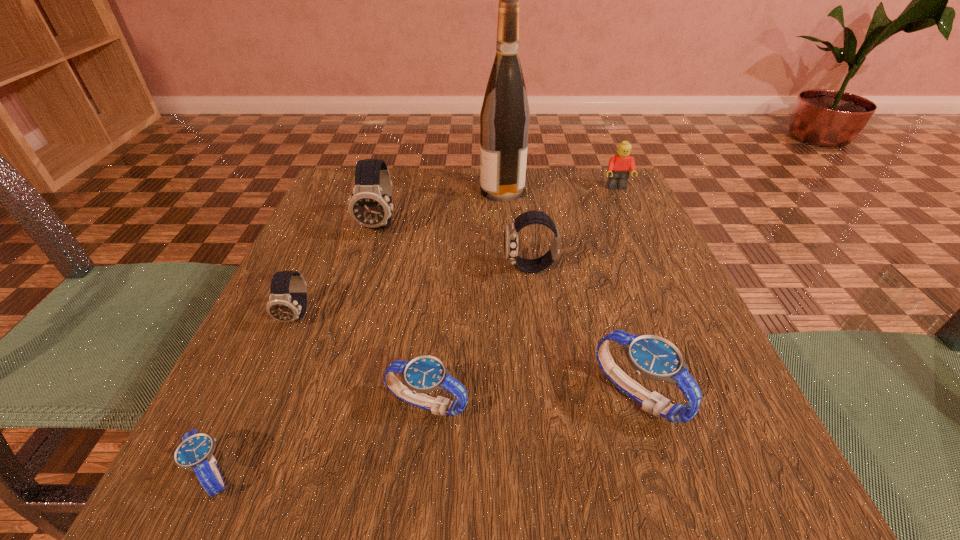
This screenshot has height=540, width=960. In order to click on object positioned at the far left corner in this screenshot , I will do `click(370, 205)`.

Locate an element on the screen. object situated at the near left corner is located at coordinates (195, 451).

Where is `object that is at the far right corner`? The image size is (960, 540). object that is at the far right corner is located at coordinates (620, 165).

The height and width of the screenshot is (540, 960). I want to click on free space at the far edge of the desktop, so click(409, 168).

Locate an element on the screen. The width and height of the screenshot is (960, 540). vacant space at the near edge is located at coordinates tap(433, 507).

Where is `free space at the left edge of the desktop`? This screenshot has width=960, height=540. free space at the left edge of the desktop is located at coordinates (242, 364).

In the image, there is a desktop. Where is `vacant space at the right edge`? vacant space at the right edge is located at coordinates (674, 301).

Locate an element on the screen. This screenshot has height=540, width=960. vacant region at the far left corner of the desktop is located at coordinates (352, 193).

In the image, there is a desktop. At what (x,y) coordinates should I click in order to perform the action: click on vacant area at the far right corner. Please return your answer as a coordinate pair (x, y). Looking at the image, I should click on (592, 171).

The width and height of the screenshot is (960, 540). Identify the location of free space at the near right corner of the desktop. (737, 463).